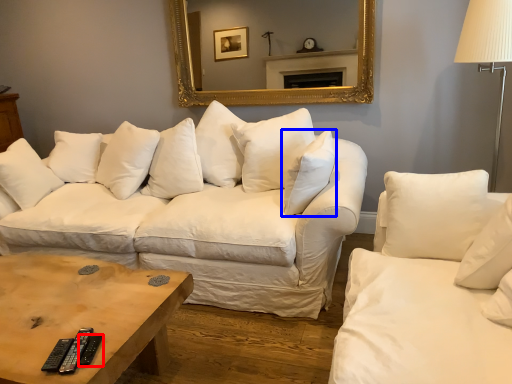
Question: Among these objects, which one is nearest to the camera, remote (highlighted by a red box) or pillow (highlighted by a blue box)?

Choices:
 (A) remote
 (B) pillow

Answer: (A)